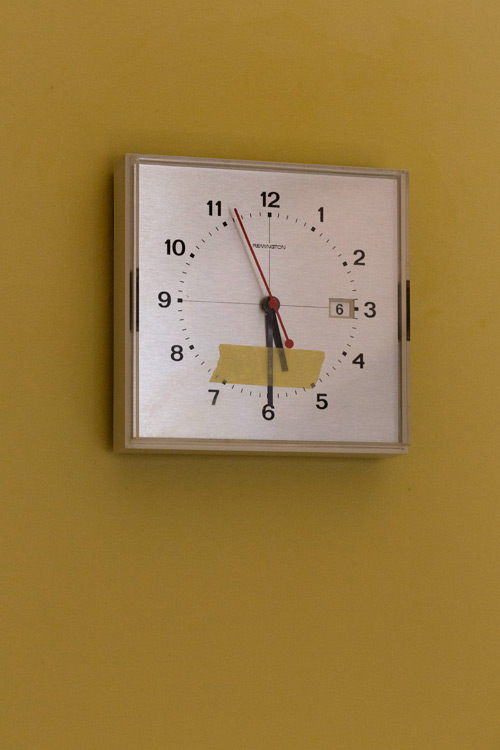
Locate an element on the screen. This screenshot has width=500, height=750. clock hands is located at coordinates (253, 250), (271, 342), (277, 336).